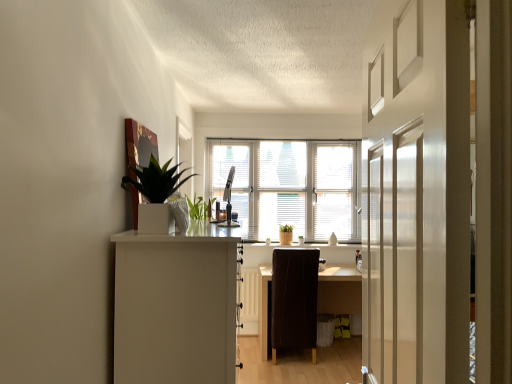
Question: Can white glossy planter at upper left be found inside white glossy window sill at center?

Choices:
 (A) yes
 (B) no

Answer: (B)

Question: Is white glossy window sill at center shorter than white glossy planter at upper left?

Choices:
 (A) no
 (B) yes

Answer: (B)

Question: Can you confirm if white glossy window sill at center is smaller than white glossy planter at upper left?

Choices:
 (A) yes
 (B) no

Answer: (A)

Question: Is white glossy window sill at center taller than white glossy planter at upper left?

Choices:
 (A) yes
 (B) no

Answer: (B)

Question: Is white glossy window sill at center positioned far away from white glossy planter at upper left?

Choices:
 (A) no
 (B) yes

Answer: (B)

Question: In terms of width, does dark brown wooden desk at center look wider or thinner when compared to white glossy door at center?

Choices:
 (A) thin
 (B) wide

Answer: (B)

Question: Is dark brown wooden desk at center in front of or behind white glossy door at center in the image?

Choices:
 (A) behind
 (B) front

Answer: (A)

Question: Considering the positions of dark brown wooden desk at center and white glossy door at center in the image, is dark brown wooden desk at center taller or shorter than white glossy door at center?

Choices:
 (A) tall
 (B) short

Answer: (B)

Question: From the image's perspective, is dark brown wooden desk at center positioned above or below white glossy door at center?

Choices:
 (A) above
 (B) below

Answer: (B)

Question: Considering the positions of white blinds at center and white matte cabinet at left in the image, is white blinds at center taller or shorter than white matte cabinet at left?

Choices:
 (A) short
 (B) tall

Answer: (B)

Question: In the image, is white blinds at center positioned in front of or behind white matte cabinet at left?

Choices:
 (A) behind
 (B) front

Answer: (A)

Question: Would you say white blinds at center is inside or outside white matte cabinet at left?

Choices:
 (A) outside
 (B) inside

Answer: (A)

Question: From the image's perspective, is white blinds at center located above or below white matte cabinet at left?

Choices:
 (A) above
 (B) below

Answer: (A)

Question: Would you say white glossy planter at upper left is to the left or to the right of white matte cabinet at left in the picture?

Choices:
 (A) left
 (B) right

Answer: (A)

Question: Considering the positions of point (157, 183) and point (130, 309), is point (157, 183) closer or farther from the camera than point (130, 309)?

Choices:
 (A) closer
 (B) farther

Answer: (B)